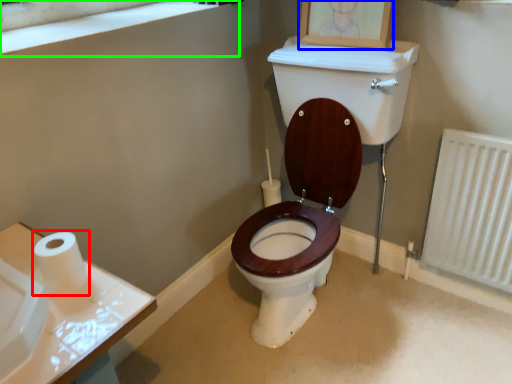
Question: Considering the real-world distances, which object is farthest from toilet paper (highlighted by a red box)? picture frame (highlighted by a blue box) or window frame (highlighted by a green box)?

Choices:
 (A) picture frame
 (B) window frame

Answer: (A)